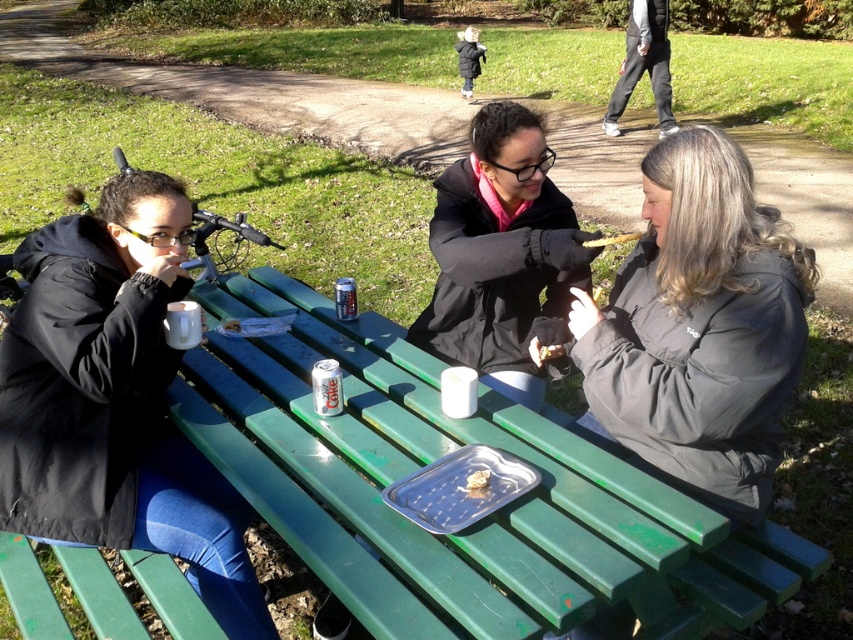
You are a photographer taking a photo of the gray matte jacket at center and the metallic blue can at center. To ensure both are in focus, you need to know their vertical positions. Which one is positioned lower in the image?

The gray matte jacket at center is located below the metallic blue can at center, so the gray matte jacket at center is positioned lower in the image.

From the picture: You are planning to place a 1.2 meter long board on the green wood picnic table at center. Considering the dark gray pants at upper right are currently occupying part of the table, can the board fit on the remaining space?

The green wood picnic table at center is wider than the dark gray pants at upper right, so the board may fit if the occupied space allows. However, the exact remaining space isn not specified, so it depends on how much area the dark gray pants at upper right are using.